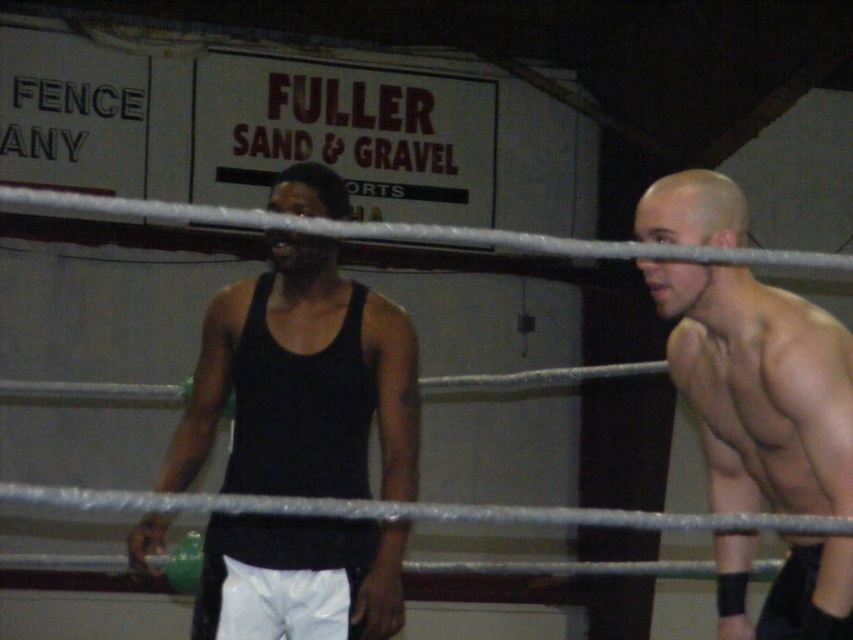
Does black matte tank top at center appear under muscular skin at right?

Incorrect, black matte tank top at center is not positioned below muscular skin at right.

Can you confirm if black matte tank top at center is positioned to the left of muscular skin at right?

Indeed, black matte tank top at center is positioned on the left side of muscular skin at right.

The image size is (853, 640). I want to click on black matte tank top at center, so click(302, 381).

Locate an element on the screen. Image resolution: width=853 pixels, height=640 pixels. black matte tank top at center is located at coordinates (302, 381).